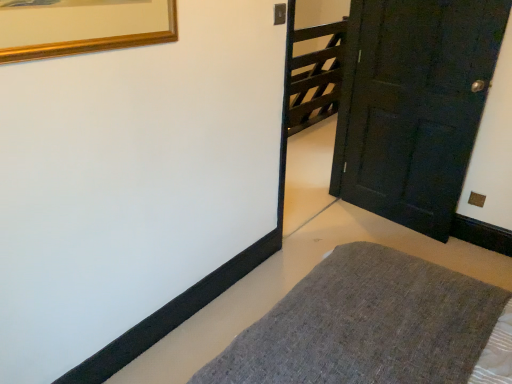
Locate an element on the screen. This screenshot has height=384, width=512. free space that is to the left of matte black door at right is located at coordinates (340, 233).